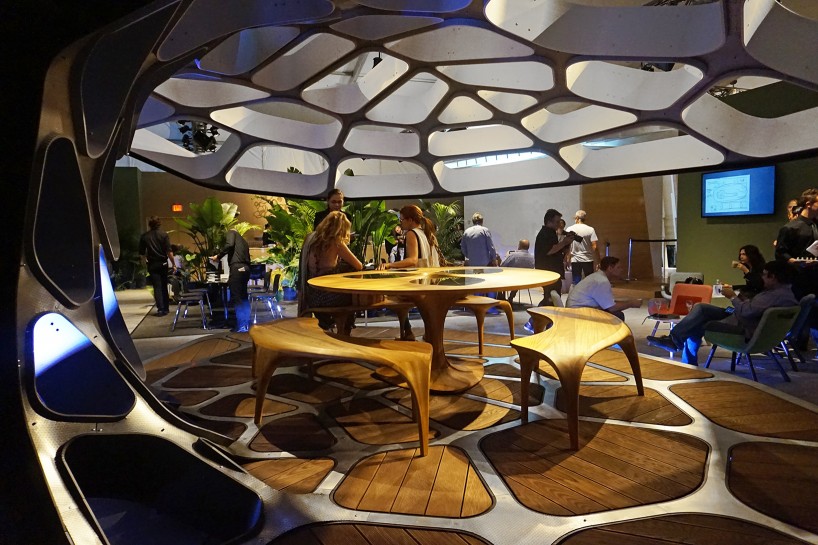
The width and height of the screenshot is (818, 545). Find the location of `wooden floor`. wooden floor is located at coordinates (540, 450), (600, 483).